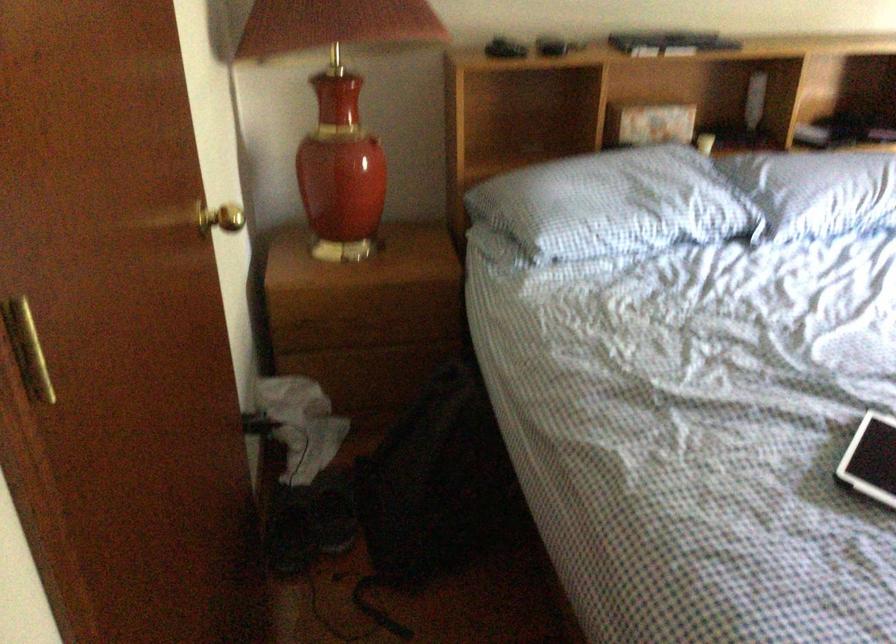
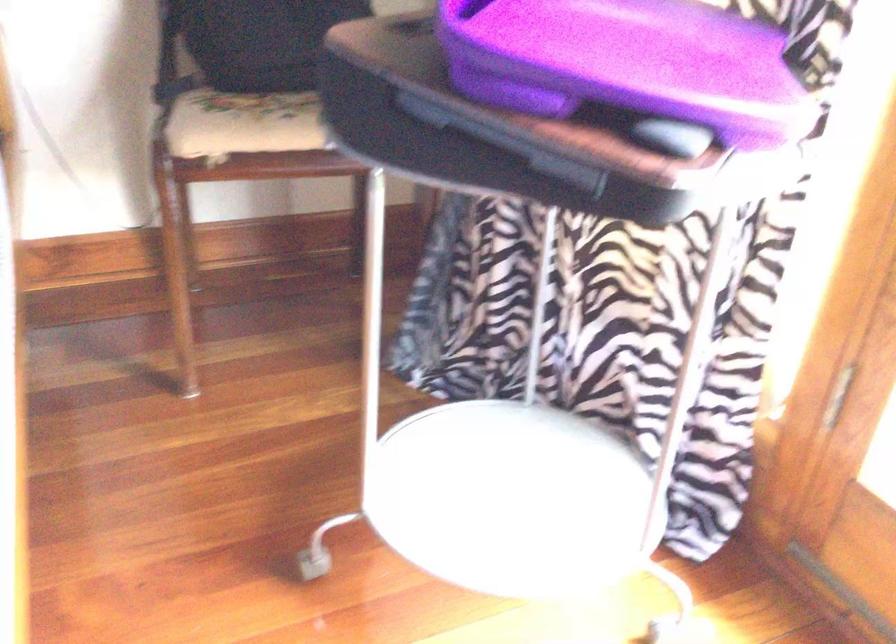
The images are taken continuously from a first-person perspective. In which direction are you moving?

The cameraman walked toward right, forward.